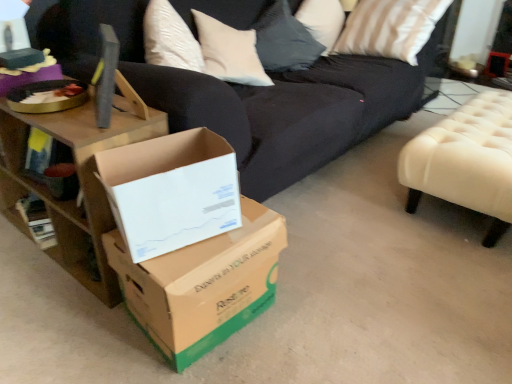
Question: Is brown cardboard box at center, which ranks as the first box in bottom-to-top order, to the left or to the right of white cardboard box at center, which is the 2th box in bottom-to-top order, in the image?

Choices:
 (A) right
 (B) left

Answer: (A)

Question: In the image, is brown cardboard box at center, which ranks as the first box in bottom-to-top order, positioned in front of or behind white cardboard box at center, placed as the first box when sorted from top to bottom?

Choices:
 (A) behind
 (B) front

Answer: (A)

Question: Considering the real-world distances, which object is farthest from the brown cardboard box at center, arranged as the 2th box when viewed from the top?

Choices:
 (A) metallic silver side table at upper right
 (B) white cardboard box at center, which is the 2th box in bottom-to-top order
 (C) white tufted ottoman at right
 (D) wooden table at left

Answer: (A)

Question: Which of these objects is positioned farthest from the brown cardboard box at center, which ranks as the first box in bottom-to-top order?

Choices:
 (A) wooden table at left
 (B) white cardboard box at center, placed as the first box when sorted from top to bottom
 (C) metallic silver side table at upper right
 (D) white tufted ottoman at right

Answer: (C)